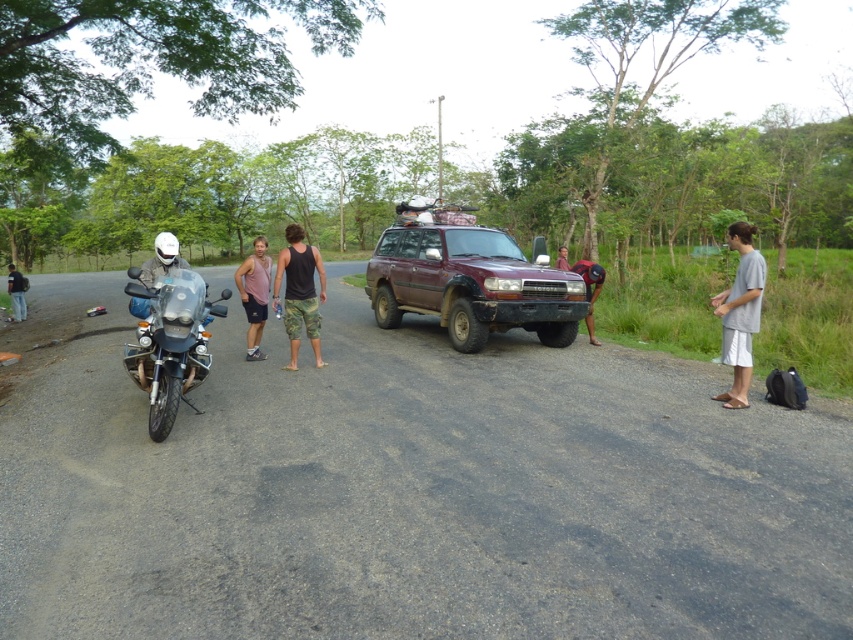
Which of these two, camo shorts at center or dark brown leather pants at center, stands taller?

camo shorts at center

Looking at this image, does camo shorts at center have a greater height compared to dark brown leather pants at center?

Correct, camo shorts at center is much taller as dark brown leather pants at center.

Find the location of a particular element. camo shorts at center is located at coordinates (299, 291).

Can you confirm if camo shorts at center is positioned to the right of brushed metal helmet at left?

Correct, you'll find camo shorts at center to the right of brushed metal helmet at left.

Is camo shorts at center wider than brushed metal helmet at left?

Incorrect, camo shorts at center's width does not surpass brushed metal helmet at left's.

Between point (273, 307) and point (9, 289), which one is positioned behind?

Positioned behind is point (9, 289).

Where is `camo shorts at center`? The width and height of the screenshot is (853, 640). camo shorts at center is located at coordinates (299, 291).

Does shiny metallic motorcycle at left appear under gray cotton shirt at right?

Correct, shiny metallic motorcycle at left is located below gray cotton shirt at right.

Looking at this image, who is more forward, (x=178, y=355) or (x=728, y=339)?

Point (x=178, y=355)

Does point (161, 275) come behind point (749, 289)?

No, it is not.

Find the location of a particular element. The image size is (853, 640). shiny metallic motorcycle at left is located at coordinates (171, 342).